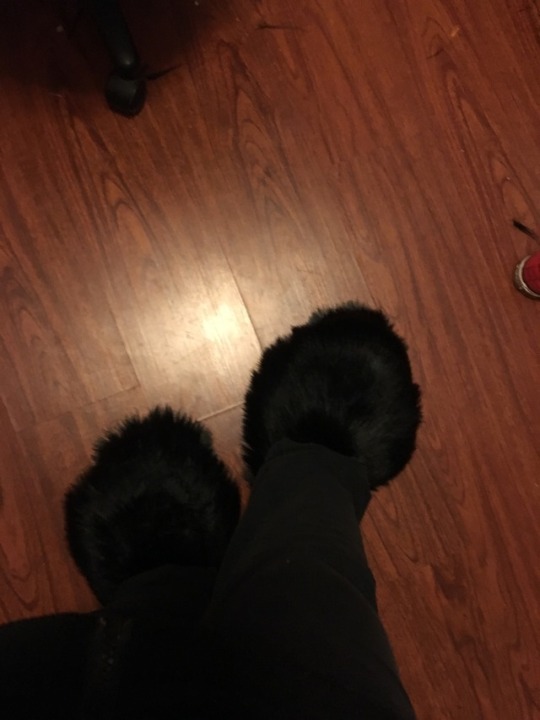
Find the location of a particular element. wood floor, brown is located at coordinates (472, 512).